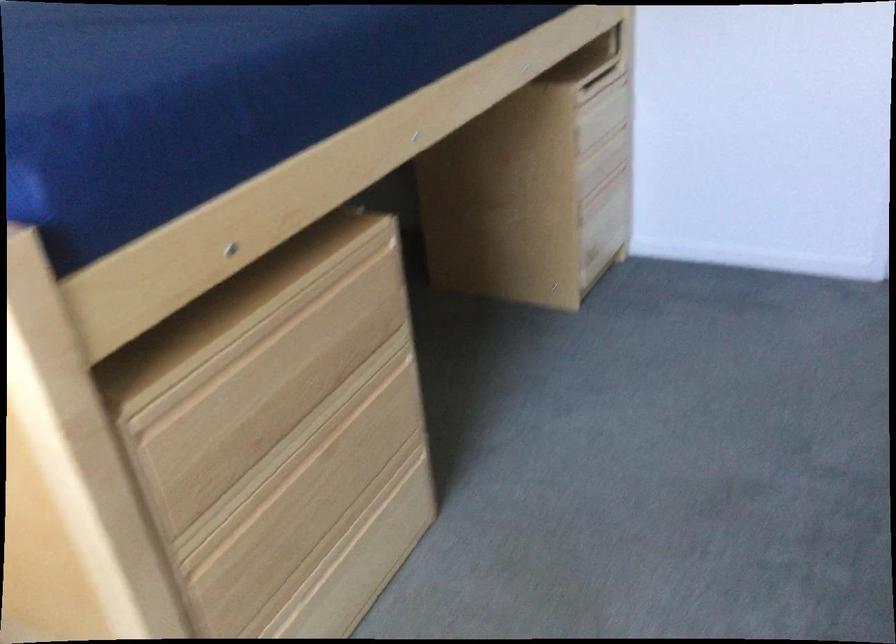
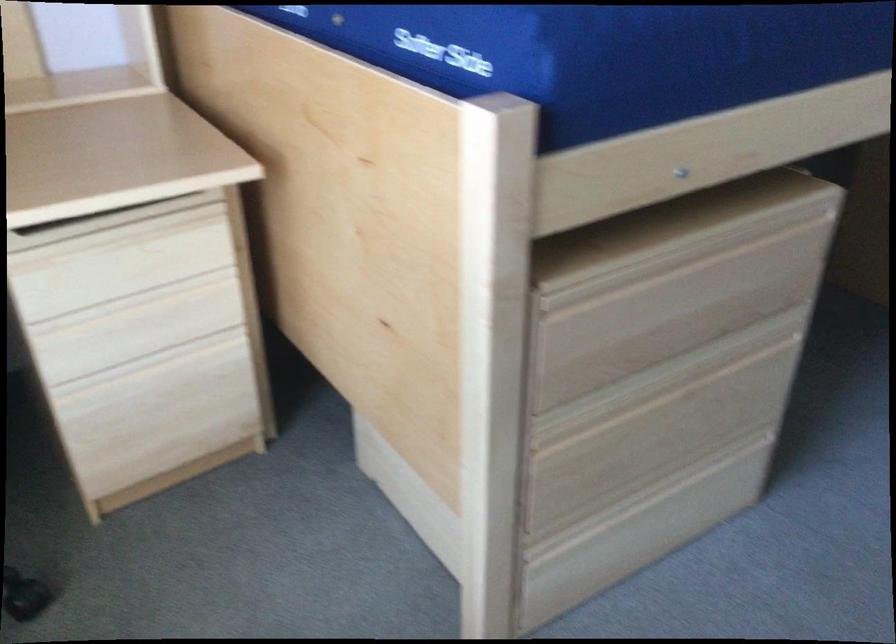
Locate, in the second image, the point that corresponds to the point at 248,315 in the first image.

(668, 240)